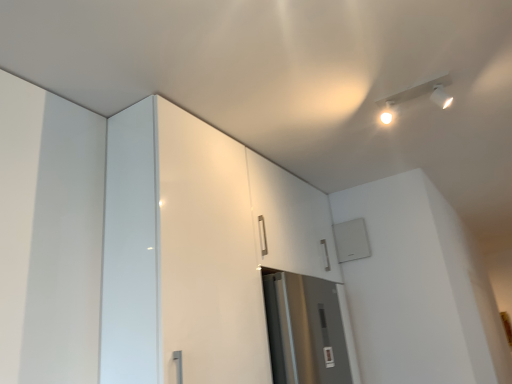
I want to click on white glossy cabinet at upper left, so click(197, 248).

What do you see at coordinates (197, 248) in the screenshot?
I see `white glossy cabinet at upper left` at bounding box center [197, 248].

This screenshot has width=512, height=384. Describe the element at coordinates (417, 96) in the screenshot. I see `white plastic track lighting at upper right` at that location.

Where is `white plastic track lighting at upper right`? The image size is (512, 384). white plastic track lighting at upper right is located at coordinates pos(417,96).

Where is `white glossy cabinet at upper left`? This screenshot has width=512, height=384. white glossy cabinet at upper left is located at coordinates (197, 248).

Does white plastic track lighting at upper right appear on the left side of white glossy cabinet at upper left?

No, white plastic track lighting at upper right is not to the left of white glossy cabinet at upper left.

Considering the relative positions of white plastic track lighting at upper right and white glossy cabinet at upper left in the image provided, is white plastic track lighting at upper right in front of white glossy cabinet at upper left?

No, it is behind white glossy cabinet at upper left.

Is point (420, 90) closer or farther from the camera than point (204, 228)?

Point (420, 90).

From the image's perspective, is white plastic track lighting at upper right above white glossy cabinet at upper left?

Yes.

From a real-world perspective, which object stands above the other?

white plastic track lighting at upper right, from a real-world perspective.

Does white plastic track lighting at upper right have a lesser width compared to white glossy cabinet at upper left?

Yes, white plastic track lighting at upper right is thinner than white glossy cabinet at upper left.

Between white plastic track lighting at upper right and white glossy cabinet at upper left, which one has more height?

white glossy cabinet at upper left is taller.

Between white plastic track lighting at upper right and white glossy cabinet at upper left, which one has smaller size?

white plastic track lighting at upper right is smaller.

Choose the correct answer: Is white plastic track lighting at upper right inside white glossy cabinet at upper left or outside it?

The correct answer is: outside.

Is white plastic track lighting at upper right far from white glossy cabinet at upper left?

No, white plastic track lighting at upper right is in close proximity to white glossy cabinet at upper left.

Could you tell me if white plastic track lighting at upper right is facing white glossy cabinet at upper left?

No, white plastic track lighting at upper right is not oriented towards white glossy cabinet at upper left.

How many degrees apart are the facing directions of white plastic track lighting at upper right and white glossy cabinet at upper left?

91 degrees.

Measure the distance from white plastic track lighting at upper right to white glossy cabinet at upper left.

white plastic track lighting at upper right and white glossy cabinet at upper left are 98.33 centimeters apart from each other.

You are a GUI agent. You are given a task and a screenshot of the screen. Output one action in this format:
    pyautogui.click(x=<x>, y=<y>)
    Task: Click on the light fixture behind the white glossy cabinet at upper left
    The image size is (512, 384).
    Given the screenshot: What is the action you would take?
    pyautogui.click(x=417, y=96)

Is white glossy cabinet at upper left to the left or to the right of white plastic track lighting at upper right in the image?

In the image, white glossy cabinet at upper left appears on the left side of white plastic track lighting at upper right.

Is the position of white glossy cabinet at upper left more distant than that of white plastic track lighting at upper right?

No, white glossy cabinet at upper left is closer to the viewer.

Considering the positions of point (281, 199) and point (439, 87), is point (281, 199) closer or farther from the camera than point (439, 87)?

Point (281, 199) is farther from the camera than point (439, 87).

Consider the image. From the image's perspective, does white glossy cabinet at upper left appear higher than white plastic track lighting at upper right?

Incorrect, from the image's perspective, white glossy cabinet at upper left is lower than white plastic track lighting at upper right.

From a real-world perspective, is white glossy cabinet at upper left physically above white plastic track lighting at upper right?

No, from a real-world perspective, white glossy cabinet at upper left is not over white plastic track lighting at upper right

Considering the sizes of white glossy cabinet at upper left and white plastic track lighting at upper right in the image, is white glossy cabinet at upper left wider or thinner than white plastic track lighting at upper right?

white glossy cabinet at upper left is wider than white plastic track lighting at upper right.

Is white glossy cabinet at upper left shorter than white plastic track lighting at upper right?

No.

Who is smaller, white glossy cabinet at upper left or white plastic track lighting at upper right?

Smaller between the two is white plastic track lighting at upper right.

Can white plastic track lighting at upper right be found inside white glossy cabinet at upper left?

That's incorrect, white plastic track lighting at upper right is not inside white glossy cabinet at upper left.

From the picture: Is white glossy cabinet at upper left not close to white plastic track lighting at upper right?

No, there isn't a large distance between white glossy cabinet at upper left and white plastic track lighting at upper right.

Is white glossy cabinet at upper left oriented towards white plastic track lighting at upper right?

Yes, white glossy cabinet at upper left is oriented towards white plastic track lighting at upper right.

In the scene shown: Can you tell me how much white glossy cabinet at upper left and white plastic track lighting at upper right differ in facing direction?

91 degrees.

The width and height of the screenshot is (512, 384). In order to click on light fixture on the right of white glossy cabinet at upper left in this screenshot , I will do `click(417, 96)`.

This screenshot has height=384, width=512. I want to click on dresser to the left of white plastic track lighting at upper right, so click(x=197, y=248).

This screenshot has width=512, height=384. Find the location of `dresser below the white plastic track lighting at upper right (from the image's perspective)`. dresser below the white plastic track lighting at upper right (from the image's perspective) is located at coordinates (197, 248).